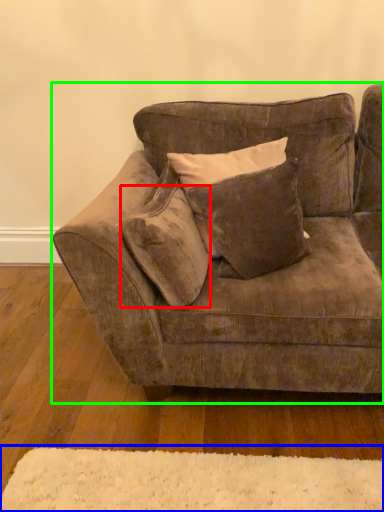
Question: Which object is positioned closest to pillow (highlighted by a red box)? Select from mat (highlighted by a blue box) and studio couch (highlighted by a green box).

Choices:
 (A) mat
 (B) studio couch

Answer: (B)